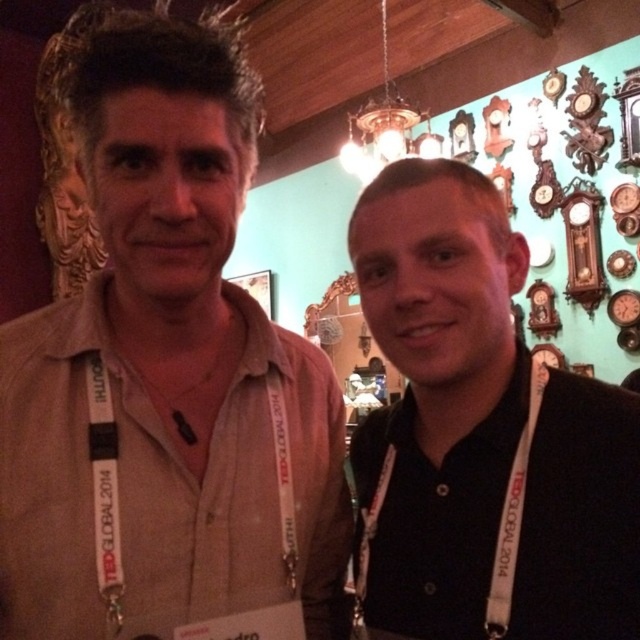
From the picture: You are a photographer at a TEDx event. You need to adjust the camera focus so that both the beige cotton shirt at center and the black matte shirt at right are in focus. Given that the depth of field can only cover a vertical distance of 1 meter, will the current setup work?

The beige cotton shirt at center is much taller than the black matte shirt at right. Since the vertical distance between them is less than 1 meter, the current depth of field should suffice to keep both in focus.